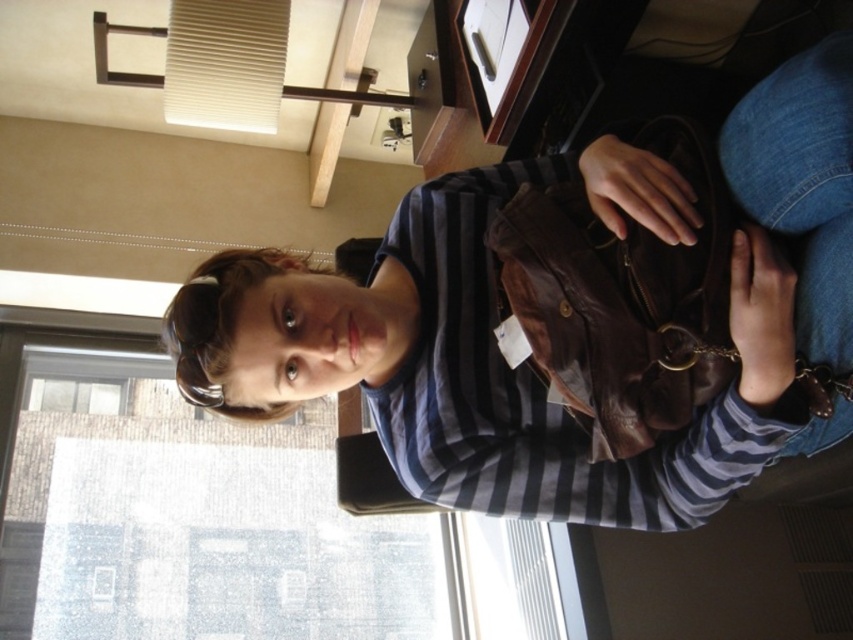
You are an interior designer planning to hang a picture frame that needs to be placed above a window. You see the matte brown purse at center and the transparent glass window at upper left in the scene. Which object should you consider as the reference point for hanging the frame above the window?

The transparent glass window at upper left is the reference point for hanging the frame above the window since the matte brown purse at center is already positioned above it.

You are an office worker who needs to place a new item on the desk. The desk has limited space. Where is the matte brown purse at center located on the desk?

The matte brown purse at center is located at point (525, 364) on the desk.

You are organizing items in an office and need to place the matte brown purse at center and the transparent glass window at upper left into storage. Which object should you place first if you need to handle the taller item first?

The transparent glass window at upper left should be handled first since it is taller than the matte brown purse at center.